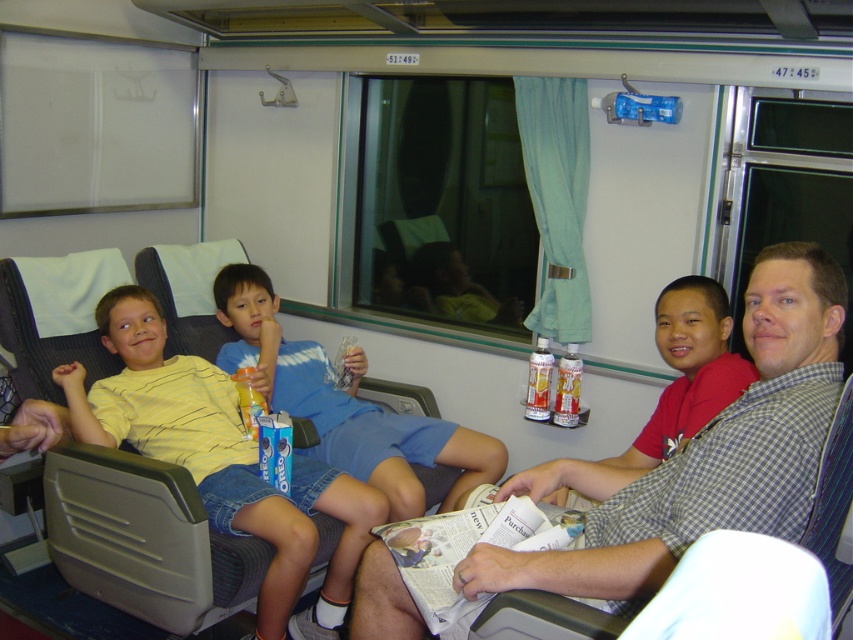
Where is the checkered fabric shirt at center located in the image?

The checkered fabric shirt at center is located at point 0.711 on the x axis and 0.822 on the y axis.

You are standing in the train compartment and want to hand a snack to the person wearing the checkered fabric shirt at center. Which direction should you move to reach them?

The checkered fabric shirt at center is located at point (700, 454), so you should move towards the right side of the image to reach them.